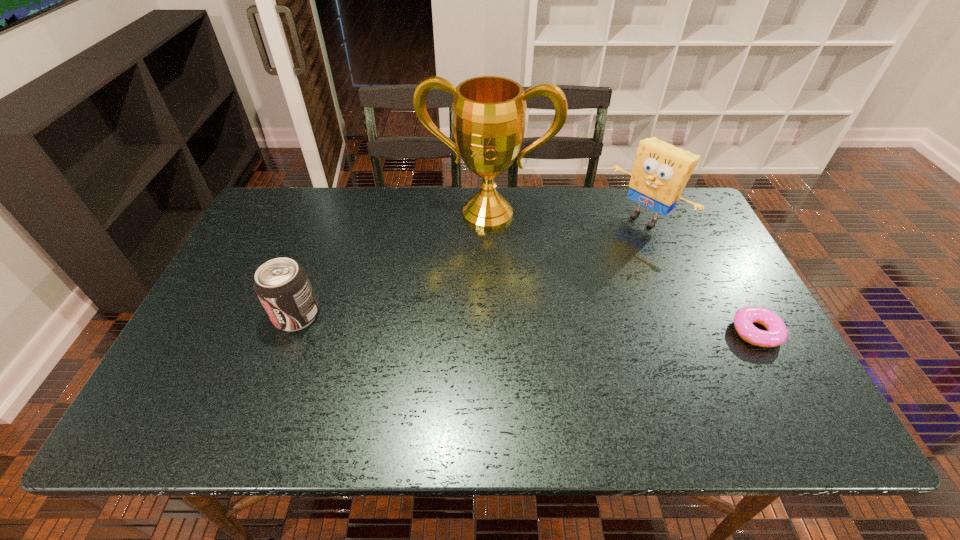
This screenshot has height=540, width=960. Find the location of `free region located on the front-facing side of the third object from right to left`. free region located on the front-facing side of the third object from right to left is located at coordinates (451, 336).

Locate an element on the screen. vacant space located 0.350m on the face of the third shortest object is located at coordinates (551, 294).

This screenshot has height=540, width=960. I want to click on blank space located 0.310m on the face of the third shortest object, so click(x=561, y=287).

I want to click on free location located 0.350m on the face of the third shortest object, so 551,294.

At what (x,y) coordinates should I click in order to perform the action: click on award that is at the far edge. Please return your answer as a coordinate pair (x, y). Looking at the image, I should click on (489, 111).

Locate an element on the screen. This screenshot has height=540, width=960. sponge present at the far edge is located at coordinates (661, 171).

At what (x,y) coordinates should I click in order to perform the action: click on doughnut that is positioned at the right edge. Please return your answer as a coordinate pair (x, y). Looking at the image, I should click on (777, 333).

Where is `sponge located at the right edge`? Image resolution: width=960 pixels, height=540 pixels. sponge located at the right edge is located at coordinates (661, 171).

At what (x,y) coordinates should I click in order to perform the action: click on object at the far right corner. Please return your answer as a coordinate pair (x, y). Looking at the image, I should click on (661, 171).

This screenshot has height=540, width=960. Identify the location of blank space at the far edge. (421, 199).